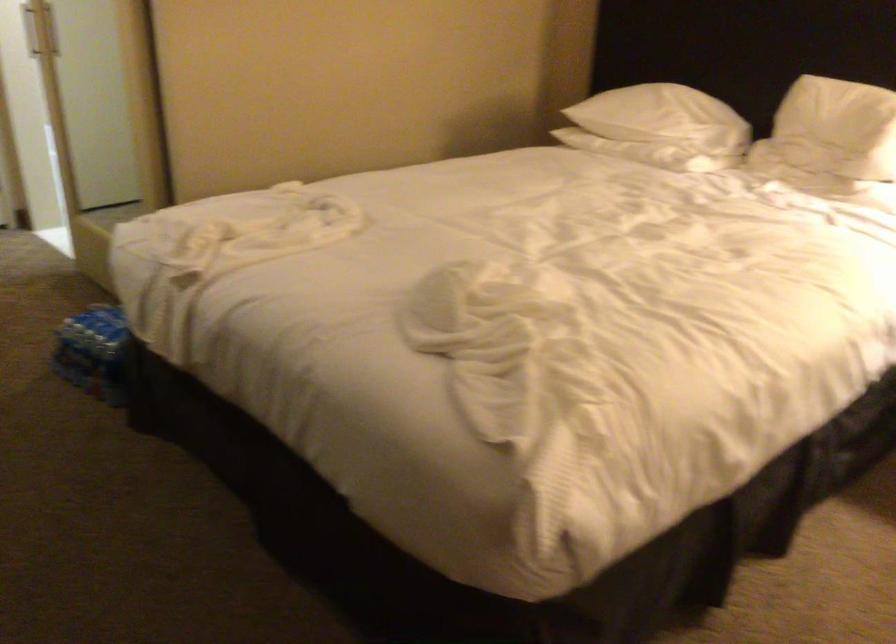
Find the location of a particular element. Image resolution: width=896 pixels, height=644 pixels. door handle is located at coordinates (39, 29).